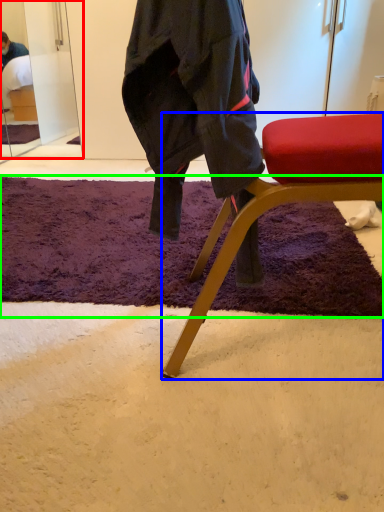
Question: Based on their relative distances, which object is farther from mirror (highlighted by a red box)? Choose from chair (highlighted by a blue box) and mat (highlighted by a green box).

Choices:
 (A) chair
 (B) mat

Answer: (A)